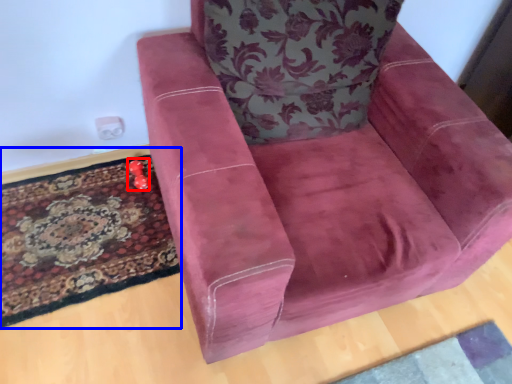
Question: Which object appears closest to the camera in this image, toy (highlighted by a red box) or mat (highlighted by a blue box)?

Choices:
 (A) toy
 (B) mat

Answer: (B)